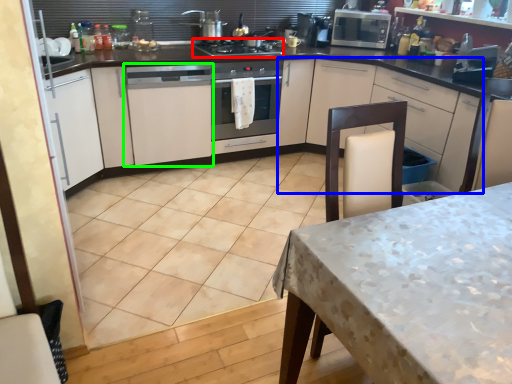
Question: Which object is the closest to the gas stove (highlighted by a red box)? Choose among these: cabinetry (highlighted by a blue box) or cabinetry (highlighted by a green box).

Choices:
 (A) cabinetry
 (B) cabinetry

Answer: (B)